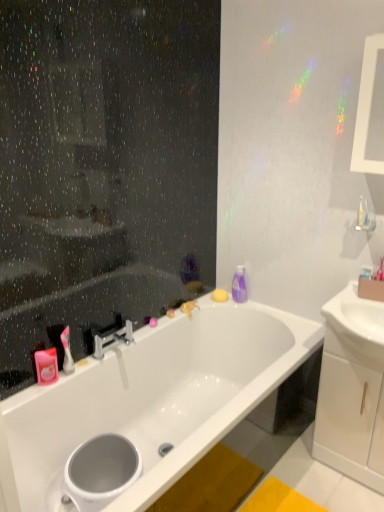
Find the location of a particular element. vacant area that is in front of purple glossy bottle at upper right, which is the 1th toiletry in right-to-left order is located at coordinates (256, 309).